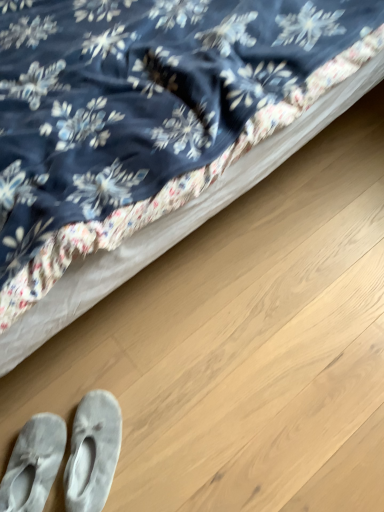
The width and height of the screenshot is (384, 512). I want to click on vacant space behind gray suede slippers at lower left, acting as the first footwear starting from the left, so coord(47,389).